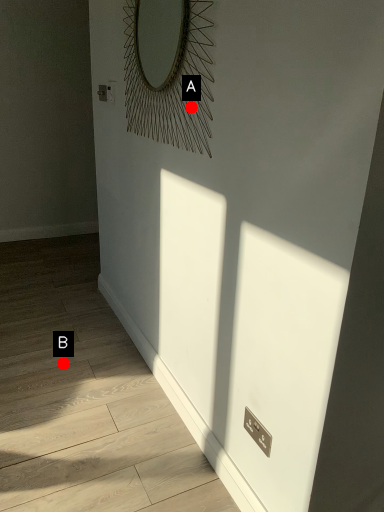
Question: Two points are circled on the image, labeled by A and B beside each circle. Which point appears closest to the camera in this image?

Choices:
 (A) A is closer
 (B) B is closer

Answer: (A)